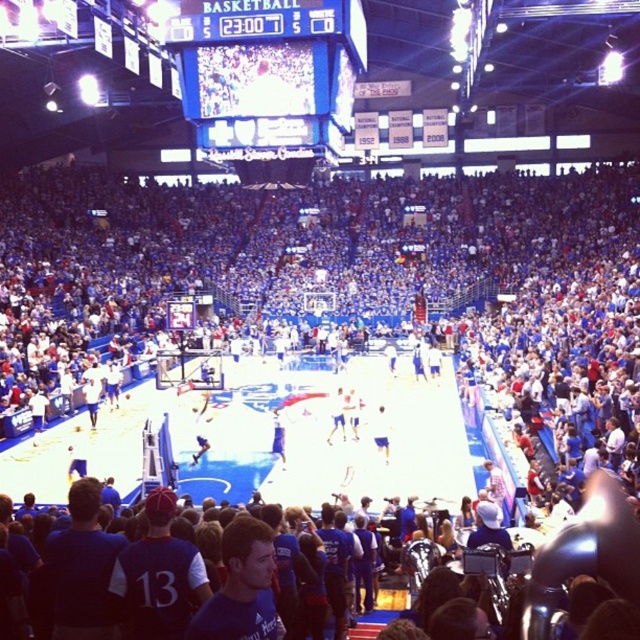
Question: Can you confirm if white jersey at center is smaller than blue jersey at center?

Choices:
 (A) no
 (B) yes

Answer: (A)

Question: Which object is positioned closest to the white fabric jersey at center?

Choices:
 (A) blue glossy scoreboard at upper center
 (B) blue fabric shorts at center

Answer: (B)

Question: Which of the following is the farthest from the observer?

Choices:
 (A) (372, 429)
 (B) (278, 445)
 (C) (280, 136)
 (D) (84, 381)

Answer: (C)

Question: Does blue glossy scoreboard at upper center appear under blue jersey at center?

Choices:
 (A) yes
 (B) no

Answer: (B)

Question: Estimate the real-world distances between objects in this image. Which object is closer to the blue fabric shorts at center?

Choices:
 (A) blue jersey at center
 (B) white fabric jersey at center
 (C) blue glossy scoreboard at upper center

Answer: (B)

Question: Is white jersey at center positioned behind blue jersey at center?

Choices:
 (A) yes
 (B) no

Answer: (B)